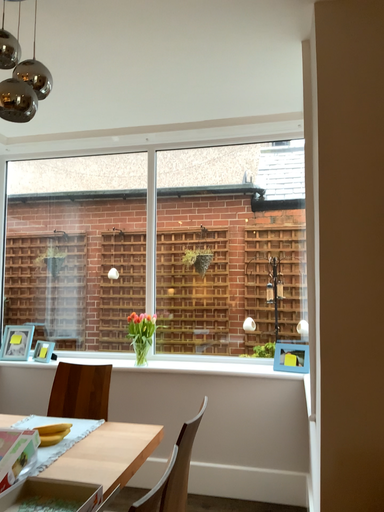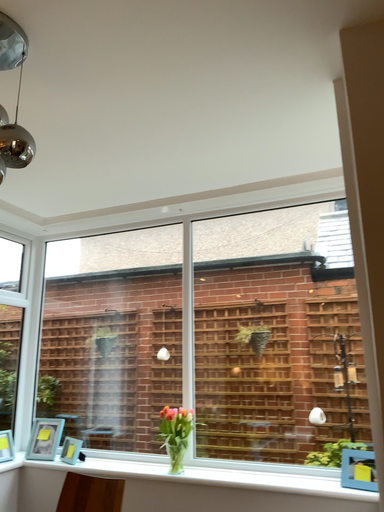
Question: Which way did the camera rotate in the video?

Choices:
 (A) rotated upward
 (B) rotated downward

Answer: (A)